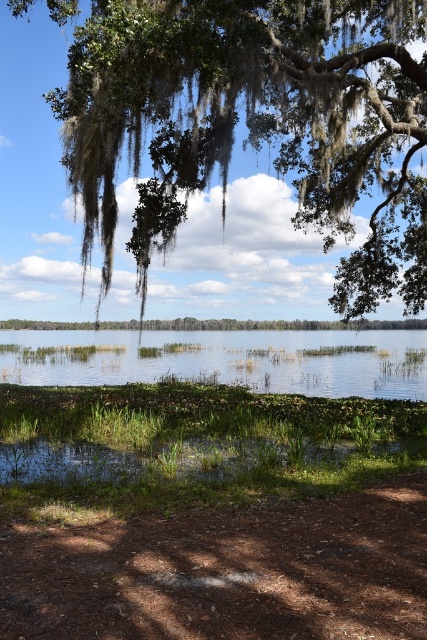
What are the coordinates of the green mossy oak tree at upper left in the image?

The green mossy oak tree at upper left is located at coordinates point (251, 129).

You are standing at the edge of the lake and notice two points marked in the scene. The first point is located at coordinates point (335, 104) and the second at point (353, 385). Which point is closer to you?

Point (335, 104) is in front of point (353, 385), so it is closer to you.